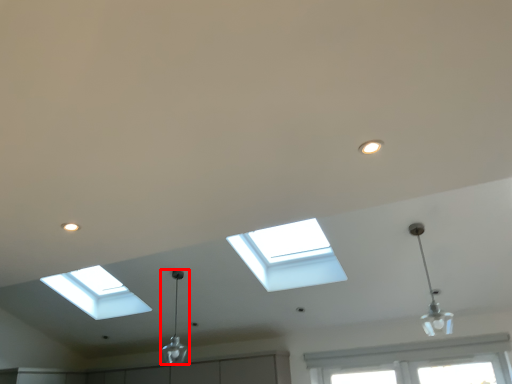
Question: From the image's perspective, considering the relative positions of lamp (annotated by the red box) and lamp in the image provided, where is lamp (annotated by the red box) located with respect to the staircase?

Choices:
 (A) above
 (B) below

Answer: (B)